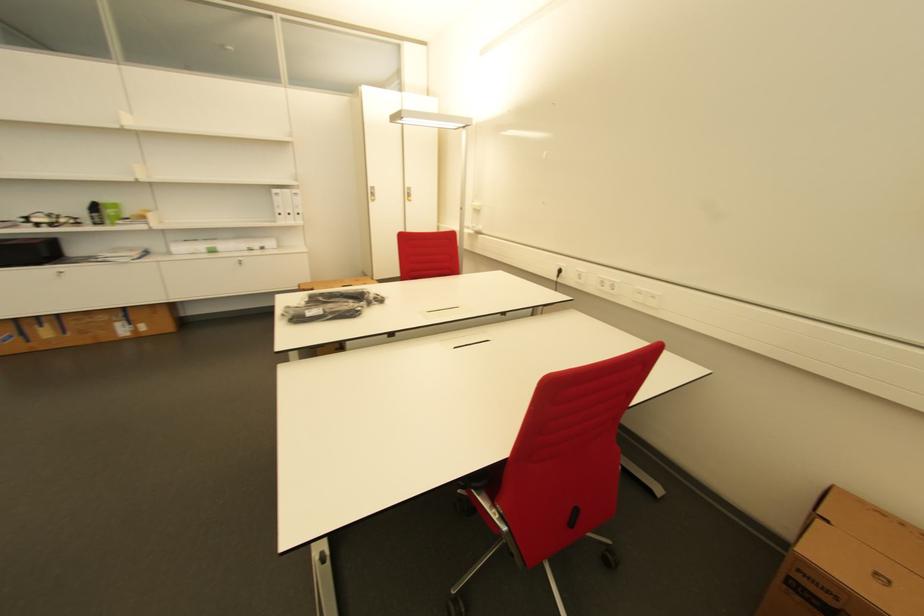
The image size is (924, 616). I want to click on white ring binder, so click(284, 204).